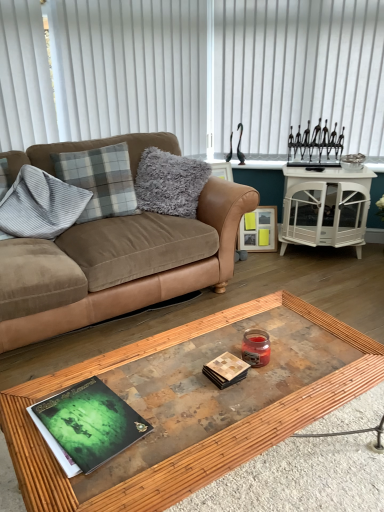
What is the approximate width of suede couch at left?

suede couch at left is 3.37 feet in width.

Where is `green matte book at center, the first magazine viewed from the left`? The width and height of the screenshot is (384, 512). green matte book at center, the first magazine viewed from the left is located at coordinates (87, 425).

This screenshot has height=512, width=384. I want to click on plaid fabric pillow at upper left, which ranks as the second pillow in left-to-right order, so click(100, 180).

This screenshot has height=512, width=384. What do you see at coordinates (225, 370) in the screenshot?
I see `green matte magazine at center, marked as the first magazine in a right-to-left arrangement` at bounding box center [225, 370].

I want to click on wooden glass coffee table at center, so click(189, 443).

This screenshot has height=512, width=384. In order to click on suede couch at left in this screenshot , I will do `click(117, 266)`.

Considering the sizes of objects white vertical blinds at upper center, which is the second blind in left-to-right order, and gray fluffy pillow at upper left, arranged as the first pillow when viewed from the right, in the image provided, who is smaller, white vertical blinds at upper center, which is the second blind in left-to-right order, or gray fluffy pillow at upper left, arranged as the first pillow when viewed from the right,?

white vertical blinds at upper center, which is the second blind in left-to-right order.

Is white vertical blinds at upper center, the first blind viewed from the right, positioned in front of gray fluffy pillow at upper left, arranged as the first pillow when viewed from the right?

No, white vertical blinds at upper center, the first blind viewed from the right, is further to the viewer.

Is white vertical blinds at upper center, the first blind viewed from the right, wider or thinner than gray fluffy pillow at upper left, arranged as the first pillow when viewed from the right?

Considering their sizes, white vertical blinds at upper center, the first blind viewed from the right, looks slimmer than gray fluffy pillow at upper left, arranged as the first pillow when viewed from the right.

This screenshot has width=384, height=512. There is a gray fluffy pillow at upper left, arranged as the first pillow when viewed from the right. Identify the location of the 1st blind above it (from a real-world perspective). (298, 71).

Is there a large distance between green matte book at center, the 2th magazine positioned from the right, and white glossy cabinet at upper right?

That's right, there is a large distance between green matte book at center, the 2th magazine positioned from the right, and white glossy cabinet at upper right.

Would you say green matte book at center, the first magazine viewed from the left, is outside white glossy cabinet at upper right?

green matte book at center, the first magazine viewed from the left, lies outside white glossy cabinet at upper right's area.

From a real-world perspective, between green matte book at center, the first magazine viewed from the left, and white glossy cabinet at upper right, who is vertically lower?

white glossy cabinet at upper right.

From the picture: Does suede couch at left have a greater height compared to wooden picture frame at upper right?

Yes, suede couch at left is taller than wooden picture frame at upper right.

Does point (28, 245) come farther from viewer compared to point (268, 222)?

No, (28, 245) is in front of (268, 222).

From a real-world perspective, is suede couch at left above or below wooden picture frame at upper right?

Clearly, from a real-world perspective, suede couch at left is above wooden picture frame at upper right.

There is a wooden glass coffee table at center. Identify the location of the 3rd pillow above it (from a real-world perspective). This screenshot has height=512, width=384. [100, 180].

In the image, is plaid fabric pillow at upper left, the 2th pillow in the right-to-left sequence, positioned in front of or behind wooden glass coffee table at center?

Clearly, plaid fabric pillow at upper left, the 2th pillow in the right-to-left sequence, is behind wooden glass coffee table at center.

Is plaid fabric pillow at upper left, the 2th pillow in the right-to-left sequence, placed right next to wooden glass coffee table at center?

There is a gap between plaid fabric pillow at upper left, the 2th pillow in the right-to-left sequence, and wooden glass coffee table at center.

Does plaid fabric pillow at upper left, which ranks as the second pillow in left-to-right order, have a lesser height compared to wooden glass coffee table at center?

No, plaid fabric pillow at upper left, which ranks as the second pillow in left-to-right order, is not shorter than wooden glass coffee table at center.

From the image's perspective, between white vertical blinds at upper left, the second blind when ordered from right to left, and green matte magazine at center, which ranks as the 2th magazine in left-to-right order, which one is located above?

From the image's view, white vertical blinds at upper left, the second blind when ordered from right to left, is above.

Can you confirm if white vertical blinds at upper left, which is the first blind from left to right, is positioned to the left of green matte magazine at center, marked as the first magazine in a right-to-left arrangement?

Correct, you'll find white vertical blinds at upper left, which is the first blind from left to right, to the left of green matte magazine at center, marked as the first magazine in a right-to-left arrangement.

Between point (238, 110) and point (209, 371), which one is positioned in front?

The point (209, 371) is closer.

Is plaid fabric pillow at upper left, which ranks as the second pillow in left-to-right order, in front of gray corduroy pillow at left, which ranks as the 3th pillow in right-to-left order?

No, plaid fabric pillow at upper left, which ranks as the second pillow in left-to-right order, is behind gray corduroy pillow at left, which ranks as the 3th pillow in right-to-left order.

Locate an element on the screen. This screenshot has width=384, height=512. the 1st pillow to the right of the gray corduroy pillow at left, the first pillow when ordered from left to right, counting from the anchor's position is located at coordinates (100, 180).

Considering the points (95, 182) and (30, 229), which point is behind, point (95, 182) or point (30, 229)?

The point (95, 182) is more distant.

Considering the positions of objects plaid fabric pillow at upper left, which ranks as the second pillow in left-to-right order, and gray corduroy pillow at left, which ranks as the 3th pillow in right-to-left order, in the image provided, who is more to the left, plaid fabric pillow at upper left, which ranks as the second pillow in left-to-right order, or gray corduroy pillow at left, which ranks as the 3th pillow in right-to-left order,?

From the viewer's perspective, gray corduroy pillow at left, which ranks as the 3th pillow in right-to-left order, appears more on the left side.

Is white glossy cabinet at upper right not near wooden picture frame at upper right?

white glossy cabinet at upper right is actually quite close to wooden picture frame at upper right.

Is white glossy cabinet at upper right completely or partially outside of wooden picture frame at upper right?

white glossy cabinet at upper right is positioned outside wooden picture frame at upper right.

Which of these two, white glossy cabinet at upper right or wooden picture frame at upper right, is bigger?

Bigger between the two is white glossy cabinet at upper right.

I want to click on blind on the right of gray fluffy pillow at upper left, arranged as the first pillow when viewed from the right, so click(298, 71).

From the image's perspective, which magazine is the 2nd one below the white glossy cabinet at upper right? Please provide its 2D coordinates.

[(87, 425)]

Considering their positions, is wooden picture frame at upper right positioned closer to plaid fabric pillow at upper left, which ranks as the second pillow in left-to-right order, than gray fluffy pillow at upper left, marked as the 3th pillow in a left-to-right arrangement?

gray fluffy pillow at upper left, marked as the 3th pillow in a left-to-right arrangement.

Which object lies nearer to the anchor point white vertical blinds at upper left, which is the first blind from left to right, gray fluffy pillow at upper left, marked as the 3th pillow in a left-to-right arrangement, or gray corduroy pillow at left, the first pillow when ordered from left to right?

The object closer to white vertical blinds at upper left, which is the first blind from left to right, is gray fluffy pillow at upper left, marked as the 3th pillow in a left-to-right arrangement.

Which object lies nearer to the anchor point green matte book at center, the 2th magazine positioned from the right, plaid fabric pillow at upper left, which ranks as the second pillow in left-to-right order, or wooden glass coffee table at center?

Based on the image, wooden glass coffee table at center appears to be nearer to green matte book at center, the 2th magazine positioned from the right.

Looking at the image, which one is located further to suede couch at left, white glossy cabinet at upper right or green matte magazine at center, which ranks as the 2th magazine in left-to-right order?

green matte magazine at center, which ranks as the 2th magazine in left-to-right order, is positioned further to the anchor suede couch at left.

In the scene shown: Considering their positions, is white vertical blinds at upper center, the first blind viewed from the right, positioned further to white glossy cabinet at upper right than plaid fabric pillow at upper left, the 2th pillow in the right-to-left sequence?

The object further to white glossy cabinet at upper right is plaid fabric pillow at upper left, the 2th pillow in the right-to-left sequence.

Based on their spatial positions, is wooden picture frame at upper right or green matte magazine at center, which ranks as the 2th magazine in left-to-right order, closer to gray fluffy pillow at upper left, arranged as the first pillow when viewed from the right?

The object closer to gray fluffy pillow at upper left, arranged as the first pillow when viewed from the right, is wooden picture frame at upper right.

Estimate the real-world distances between objects in this image. Which object is further from gray corduroy pillow at left, the first pillow when ordered from left to right, wooden glass coffee table at center or suede couch at left?

Based on the image, wooden glass coffee table at center appears to be further to gray corduroy pillow at left, the first pillow when ordered from left to right.

Which object lies nearer to the anchor point white vertical blinds at upper left, the second blind when ordered from right to left, green matte book at center, the 2th magazine positioned from the right, or plaid fabric pillow at upper left, the 2th pillow in the right-to-left sequence?

plaid fabric pillow at upper left, the 2th pillow in the right-to-left sequence.

Locate an element on the screen. This screenshot has width=384, height=512. studio couch located between gray corduroy pillow at left, the first pillow when ordered from left to right, and green matte magazine at center, marked as the first magazine in a right-to-left arrangement, in the left-right direction is located at coordinates (117, 266).

This screenshot has height=512, width=384. What are the coordinates of `studio couch between wooden glass coffee table at center and white vertical blinds at upper center, the first blind viewed from the right, in the front-back direction` in the screenshot? It's located at (117, 266).

Where is `table between green matte book at center, the first magazine viewed from the left, and wooden picture frame at upper right, along the z-axis`? This screenshot has width=384, height=512. table between green matte book at center, the first magazine viewed from the left, and wooden picture frame at upper right, along the z-axis is located at coordinates (325, 207).

Image resolution: width=384 pixels, height=512 pixels. Find the location of `table between wooden glass coffee table at center and white vertical blinds at upper center, the first blind viewed from the right, in the front-back direction`. table between wooden glass coffee table at center and white vertical blinds at upper center, the first blind viewed from the right, in the front-back direction is located at coordinates (325, 207).